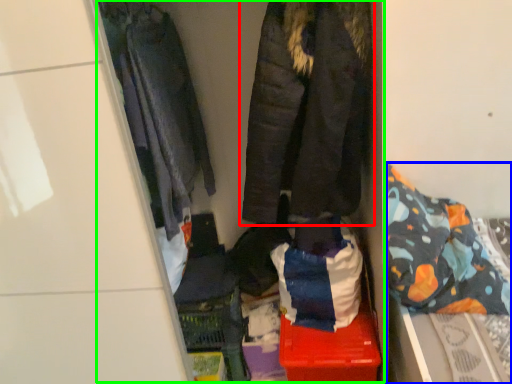
Question: Which object is positioned farthest from jacket (highlighted by a red box)? Select from bed (highlighted by a blue box) and closet (highlighted by a green box).

Choices:
 (A) bed
 (B) closet

Answer: (A)